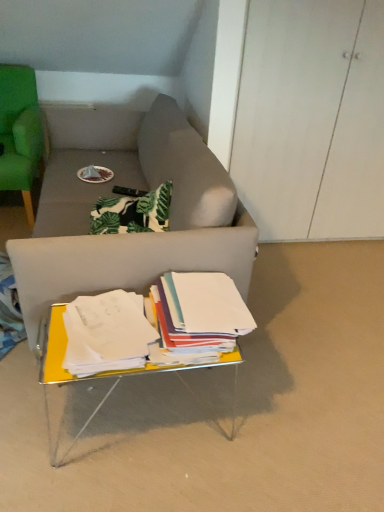
Question: Choose the correct answer: Is yellow metallic table at lower center inside white paper at center, placed as the 1th paperback book when sorted from left to right, or outside it?

Choices:
 (A) inside
 (B) outside

Answer: (B)

Question: In the image, is yellow metallic table at lower center on the left side or the right side of white paper at center, placed as the 2th paperback book when sorted from right to left?

Choices:
 (A) left
 (B) right

Answer: (B)

Question: Considering the real-world distances, which object is closest to the green fabric chair at left?

Choices:
 (A) white paper at center, placed as the 1th paperback book when sorted from left to right
 (B) white paper at center, the second paperback book in the left-to-right sequence
 (C) yellow metallic table at lower center

Answer: (A)

Question: Which object is positioned farthest from the white paper at center, marked as the first paperback book in a right-to-left arrangement?

Choices:
 (A) white paper at center, placed as the 1th paperback book when sorted from left to right
 (B) green fabric chair at left
 (C) yellow metallic table at lower center

Answer: (B)